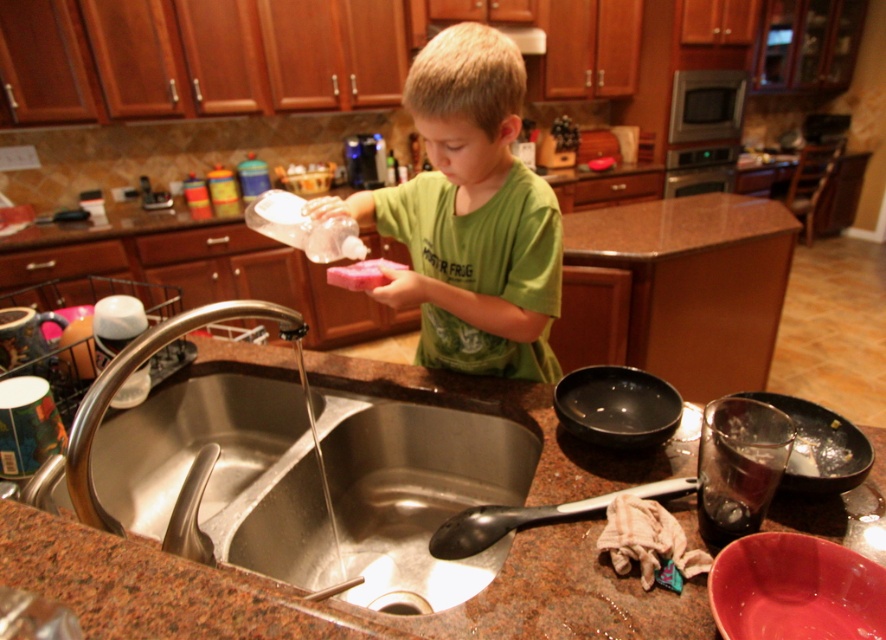
Question: Which object appears closest to the camera in this image?

Choices:
 (A) stainless steel sink at lower left
 (B) pink sponge at center

Answer: (A)

Question: Does brushed metal faucet at sink left appear under pink sponge at center?

Choices:
 (A) no
 (B) yes

Answer: (B)

Question: Which object is positioned farthest from the green matte shirt at center?

Choices:
 (A) pink sponge at center
 (B) stainless steel sink at lower left

Answer: (B)

Question: Is brushed metal faucet at sink left further to camera compared to pink sponge at center?

Choices:
 (A) no
 (B) yes

Answer: (A)

Question: Is the position of green matte shirt at center less distant than that of brushed metal faucet at sink left?

Choices:
 (A) no
 (B) yes

Answer: (A)

Question: Among these objects, which one is nearest to the camera?

Choices:
 (A) stainless steel sink at lower left
 (B) brushed metal faucet at sink left

Answer: (A)